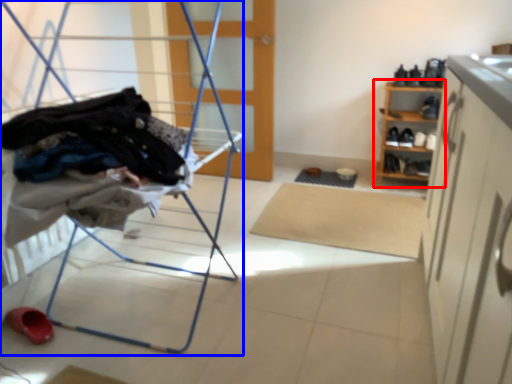
Question: Which of the following is the closest to the observer, shelf (highlighted by a red box) or furniture (highlighted by a blue box)?

Choices:
 (A) shelf
 (B) furniture

Answer: (B)